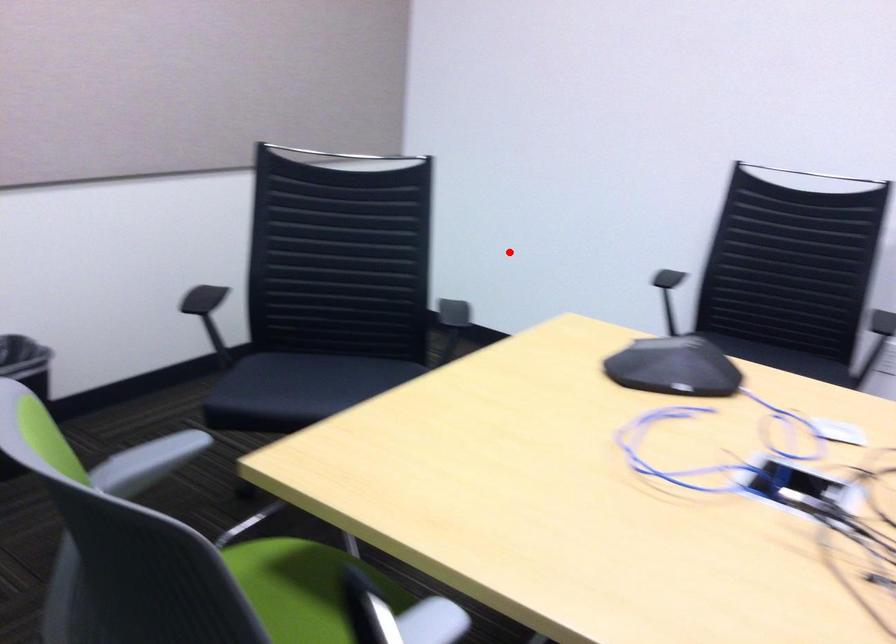
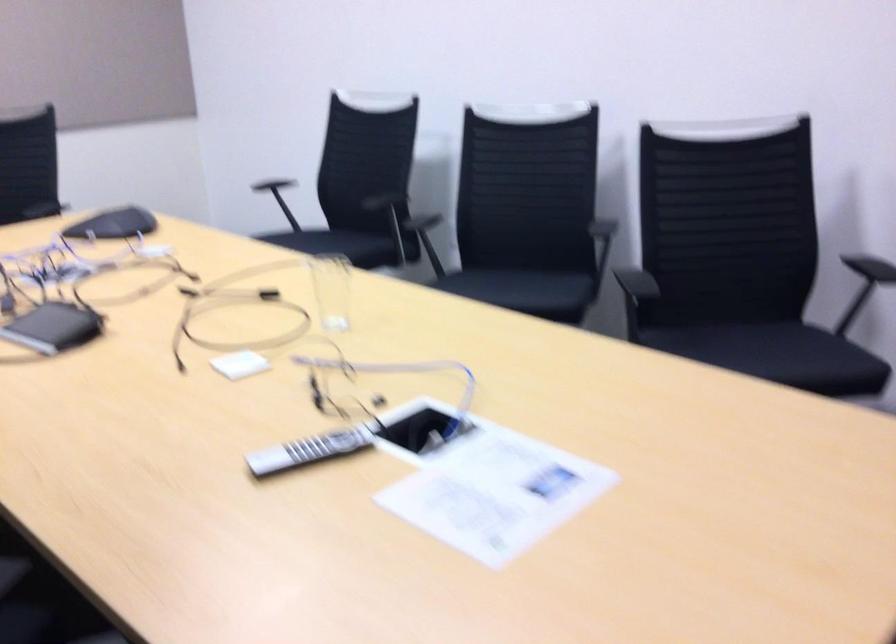
Where in the second image is the point corresponding to the highlighted location from the first image?

(271, 184)